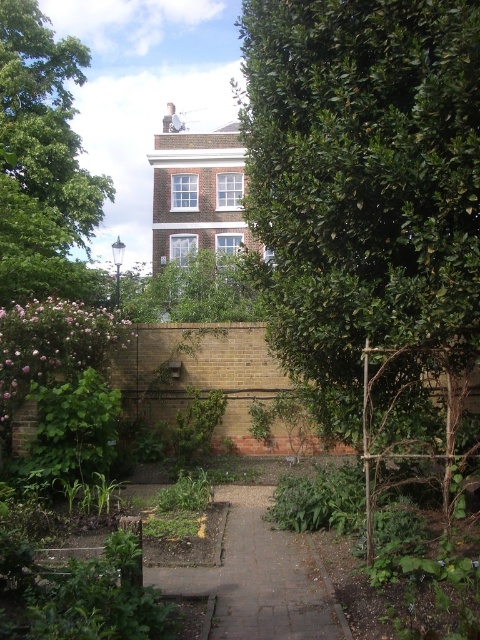
Question: Which point is farther from the camera taking this photo?

Choices:
 (A) (66, 108)
 (B) (351, 394)

Answer: (A)

Question: Can you confirm if paved stone path at center is smaller than green leafy hedge at lower left?

Choices:
 (A) yes
 (B) no

Answer: (A)

Question: Which point appears farthest from the camera in this image?

Choices:
 (A) (46, 33)
 (B) (104, 387)
 (C) (324, 161)
 (D) (321, 579)

Answer: (A)

Question: Observing the image, what is the correct spatial positioning of green leafy tree at upper center in reference to paved stone path at center?

Choices:
 (A) above
 (B) below

Answer: (A)

Question: Based on their relative distances, which object is farther from the green leafy tree at center?

Choices:
 (A) green leafy hedge at lower left
 (B) paved stone path at center
 (C) green leafy tree at upper center

Answer: (C)

Question: Can you confirm if green leafy tree at center is positioned below paved stone path at center?

Choices:
 (A) no
 (B) yes

Answer: (A)